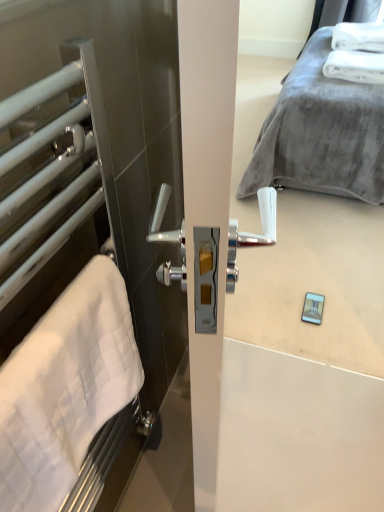
At what (x,y) coordinates should I click in order to perform the action: click on vacant space situated on the left part of white soft towel at upper right, the 1th bath towel positioned from the right. Please return your answer as a coordinate pair (x, y). Looking at the image, I should click on (302, 77).